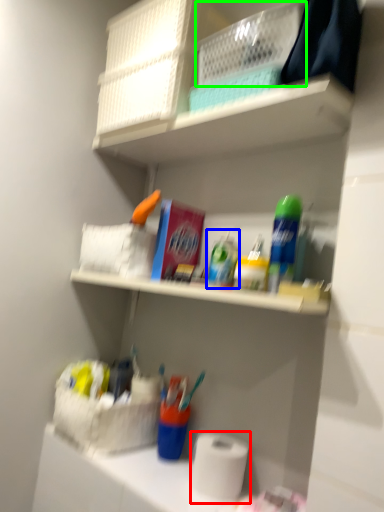
Question: Which object is the farthest from toilet paper (highlighted by a red box)? Choose among these: toiletry (highlighted by a blue box) or basket (highlighted by a green box).

Choices:
 (A) toiletry
 (B) basket

Answer: (B)